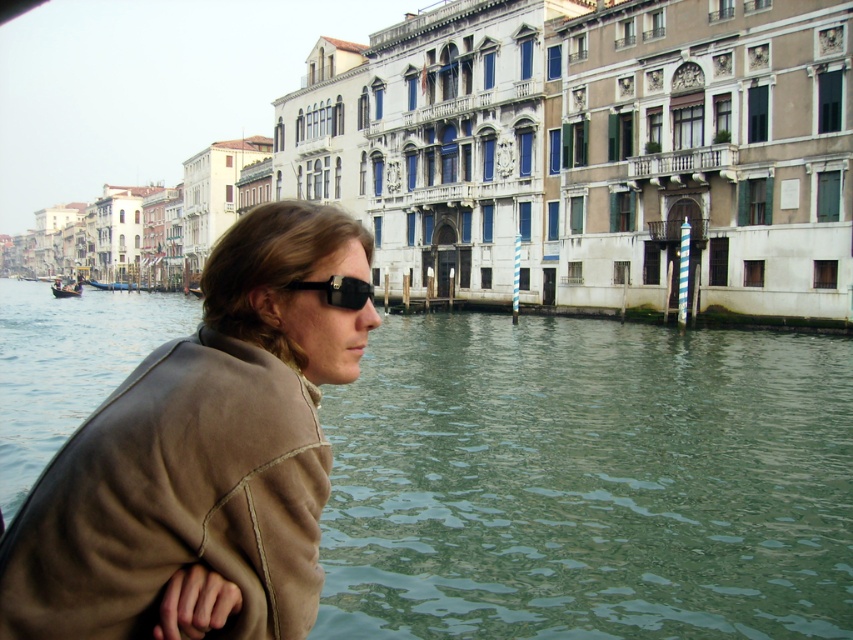
Does green water at lower left have a greater height compared to wooden gondola at left?

Indeed, green water at lower left has a greater height compared to wooden gondola at left.

Where is `green water at lower left`? Image resolution: width=853 pixels, height=640 pixels. green water at lower left is located at coordinates (589, 483).

Between point (363, 285) and point (76, 289), which one is positioned in front?

Point (363, 285) is in front.

What do you see at coordinates (338, 291) in the screenshot? The image size is (853, 640). I see `black matte sunglasses at upper left` at bounding box center [338, 291].

Which is in front, point (328, 296) or point (76, 288)?

Point (328, 296)

Where is `black matte sunglasses at upper left`? black matte sunglasses at upper left is located at coordinates (338, 291).

Can you confirm if brown leather jacket at left is bigger than black matte sunglasses at upper left?

Result: Yes, brown leather jacket at left is bigger than black matte sunglasses at upper left.

Between point (299, 618) and point (357, 301), which one is positioned in front?

Positioned in front is point (299, 618).

You are a GUI agent. You are given a task and a screenshot of the screen. Output one action in this format:
    pyautogui.click(x=<x>, y=<y>)
    Task: Click on the brown leather jacket at left
    Image resolution: width=853 pixels, height=640 pixels.
    Given the screenshot: What is the action you would take?
    pyautogui.click(x=202, y=451)